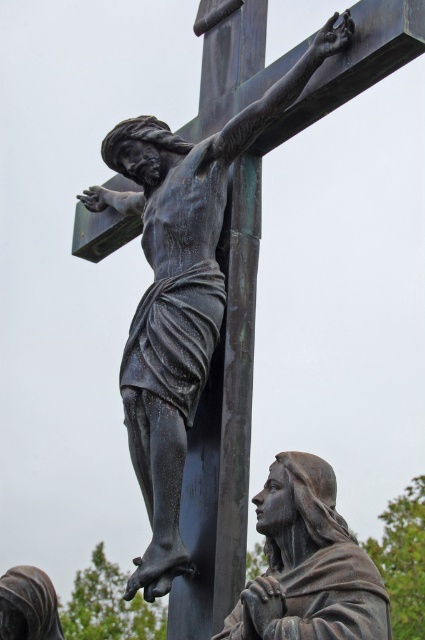
Question: Is bronze cross at center bigger than bronze statue at lower right?

Choices:
 (A) no
 (B) yes

Answer: (B)

Question: Considering the real-world distances, which object is closest to the bronze statue at lower right?

Choices:
 (A) bronze cross at center
 (B) bronze statue at center

Answer: (A)

Question: Which point is closer to the camera?

Choices:
 (A) (266, 616)
 (B) (155, 481)
 (C) (229, 566)

Answer: (A)

Question: Considering the relative positions of bronze cross at center and bronze statue at lower right in the image provided, where is bronze cross at center located with respect to bronze statue at lower right?

Choices:
 (A) below
 (B) above

Answer: (B)

Question: Which object is positioned closest to the bronze cross at center?

Choices:
 (A) bronze statue at lower right
 (B) bronze statue at center

Answer: (B)

Question: Can you confirm if bronze cross at center is wider than bronze statue at center?

Choices:
 (A) no
 (B) yes

Answer: (A)